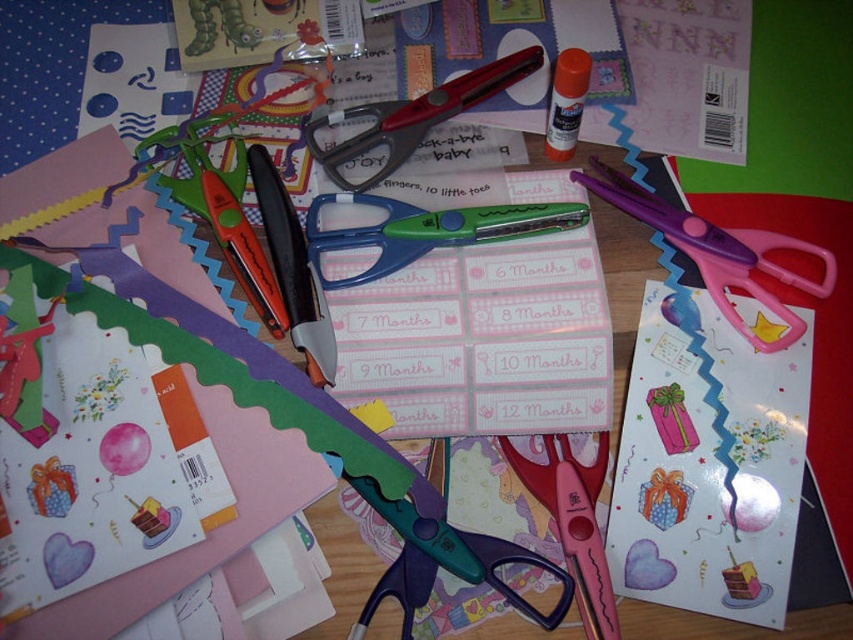
Looking at this image, you are organizing the crafting supplies on the wooden surface. You need to retrieve the green plastic scissors at center. Can you easily access them without moving the metallic red scissors at center?

The green plastic scissors at center is positioned under metallic red scissors at center, so you cannot easily access them without moving the metallic red scissors at center.

You are looking at the crafting supplies on the wooden surface. There are two points marked on the image at coordinates point (x=746, y=308) and point (x=257, y=266). Which of these two points is closer to you?

Point (x=746, y=308) is further to the camera than point (x=257, y=266), so the point closer to you is point (x=257, y=266).

You are organizing the crafting supplies on the wooden surface. You need to place a new item between the matte pink card at center and the orange plastic scissors at center. Which object should you place the new item closer to in order for it to be visible from your current viewpoint?

You should place the new item closer to the matte pink card at center because it is closer to the viewer than the orange plastic scissors at center, making it more visible from your current viewpoint.